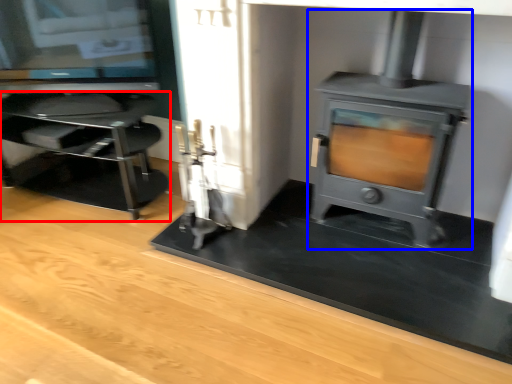
Question: Among these objects, which one is farthest to the camera, furniture (highlighted by a red box) or wood burning stove (highlighted by a blue box)?

Choices:
 (A) furniture
 (B) wood burning stove

Answer: (A)